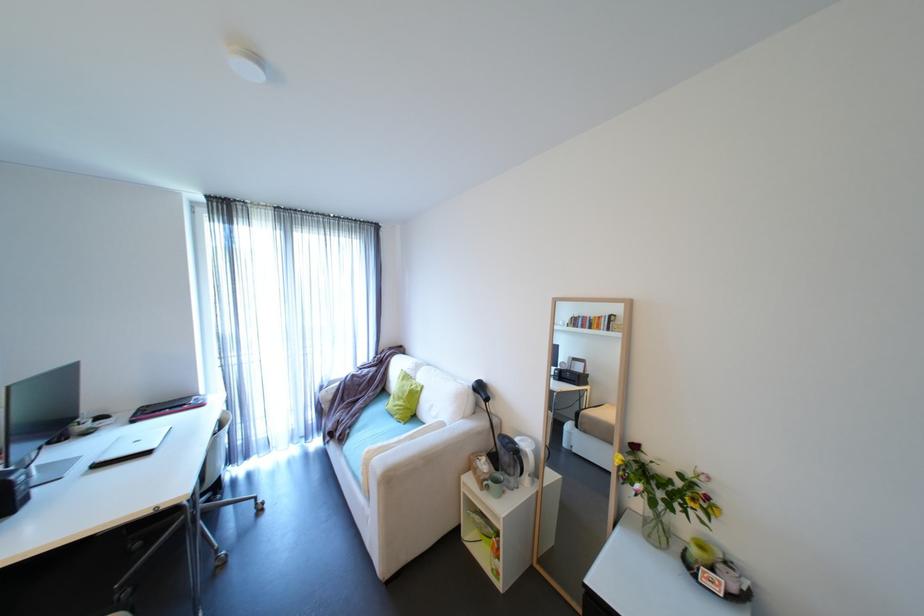
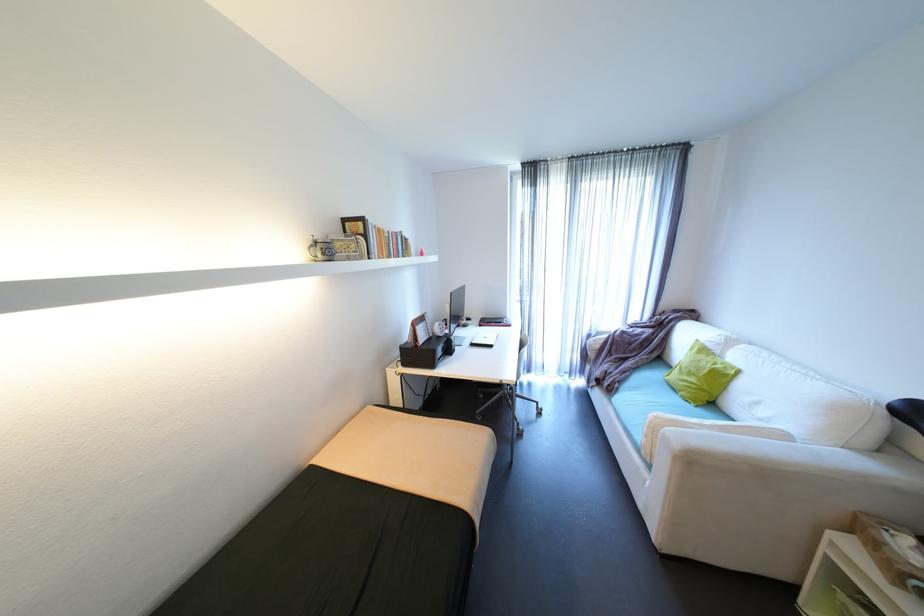
Find the pixel in the second image that matches point 430,387 in the first image.

(747, 371)